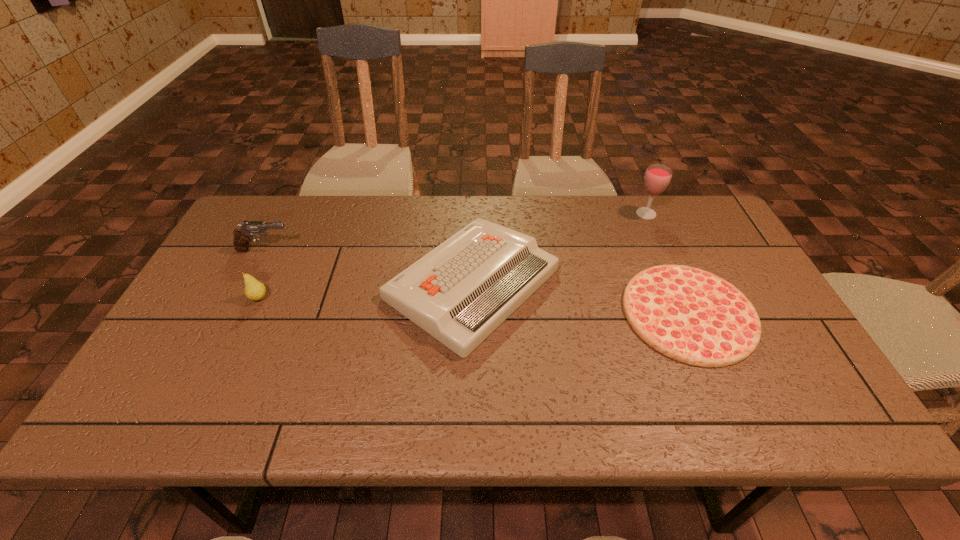
Find the location of a particular element. The width and height of the screenshot is (960, 540). free space at the right edge is located at coordinates (789, 336).

Find the location of `free region at the far left corner of the desktop`. free region at the far left corner of the desktop is located at coordinates (248, 217).

The width and height of the screenshot is (960, 540). Identify the location of blank area at the far right corner. (707, 231).

Identify the location of vacant space that is in between the third object from right to left and the pear. The image size is (960, 540). point(366,291).

Find the location of a particular element. Image resolution: width=960 pixels, height=540 pixels. vacant area that lies between the tallest object and the pistol is located at coordinates (455, 232).

Image resolution: width=960 pixels, height=540 pixels. Identify the location of unoccupied area between the farthest object and the pistol. (455, 232).

The height and width of the screenshot is (540, 960). Find the location of `free space between the computer keyboard and the pear`. free space between the computer keyboard and the pear is located at coordinates (366, 291).

At what (x,y) coordinates should I click in order to perform the action: click on vacant space in between the computer keyboard and the tallest object. Please return your answer as a coordinate pair (x, y). Image resolution: width=960 pixels, height=540 pixels. Looking at the image, I should click on (559, 249).

In order to click on vacant space in between the third object from right to left and the shortest object in this screenshot , I will do `click(580, 298)`.

Locate an element on the screen. The height and width of the screenshot is (540, 960). free space between the shortest object and the fourth tallest object is located at coordinates (580, 298).